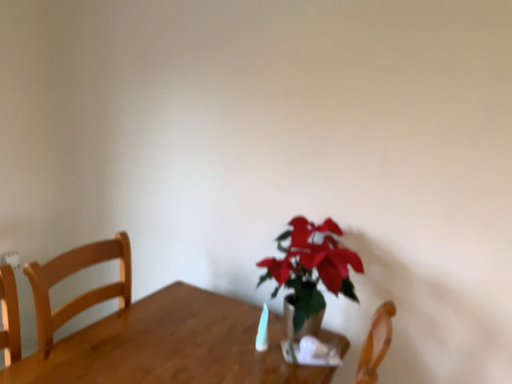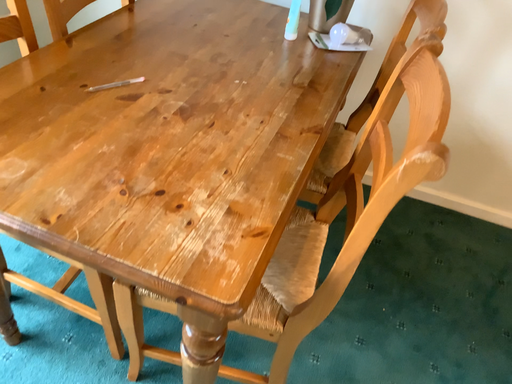
Question: How did the camera likely rotate when shooting the video?

Choices:
 (A) rotated upward
 (B) rotated downward

Answer: (B)